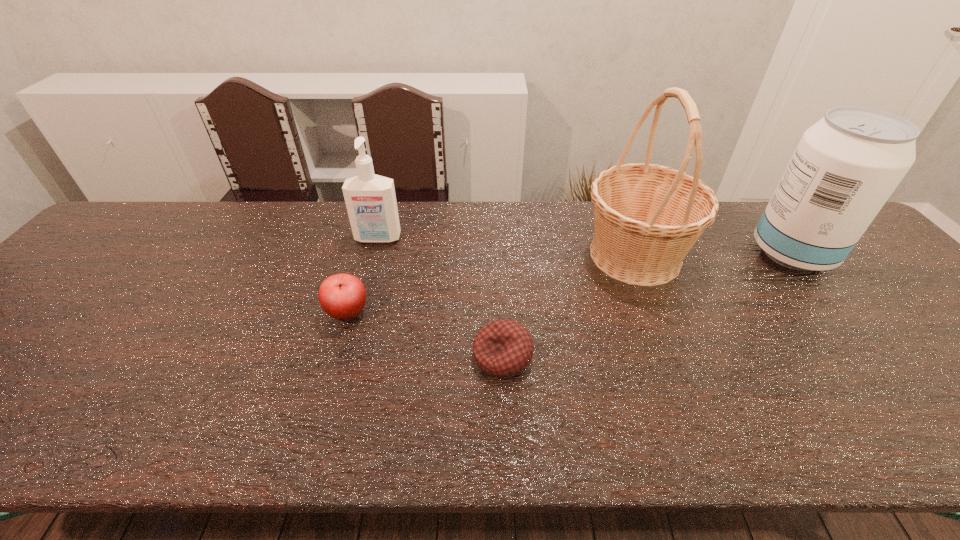
Identify the location of vacant space at the near edge. (532, 448).

Locate an element on the screen. The height and width of the screenshot is (540, 960). vacant space at the left edge is located at coordinates (46, 359).

Where is `free space at the right edge`? free space at the right edge is located at coordinates (911, 317).

In the image, there is a desktop. Where is `vacant space at the far left corner`? vacant space at the far left corner is located at coordinates (174, 219).

Where is `vacant space that is in between the basket and the shortest object`? The height and width of the screenshot is (540, 960). vacant space that is in between the basket and the shortest object is located at coordinates (569, 306).

You are a GUI agent. You are given a task and a screenshot of the screen. Output one action in this format:
    pyautogui.click(x=<x>, y=<y>)
    Task: Click on the vacant space in between the cleansing agent and the fourth tallest object
    Image resolution: width=960 pixels, height=540 pixels.
    Given the screenshot: What is the action you would take?
    pyautogui.click(x=363, y=275)

Where is `free area in between the second tallest object and the cleansing agent`? This screenshot has width=960, height=540. free area in between the second tallest object and the cleansing agent is located at coordinates (585, 246).

The width and height of the screenshot is (960, 540). Identify the location of free space between the apple and the shortest object. (425, 334).

At what (x,y) coordinates should I click in order to perform the action: click on vacant point located between the rightmost object and the third object from left to right. Please return your answer as a coordinate pair (x, y). Looking at the image, I should click on (647, 305).

The image size is (960, 540). Identify the location of vacant space that's between the alcohol and the second object from right to left. (713, 254).